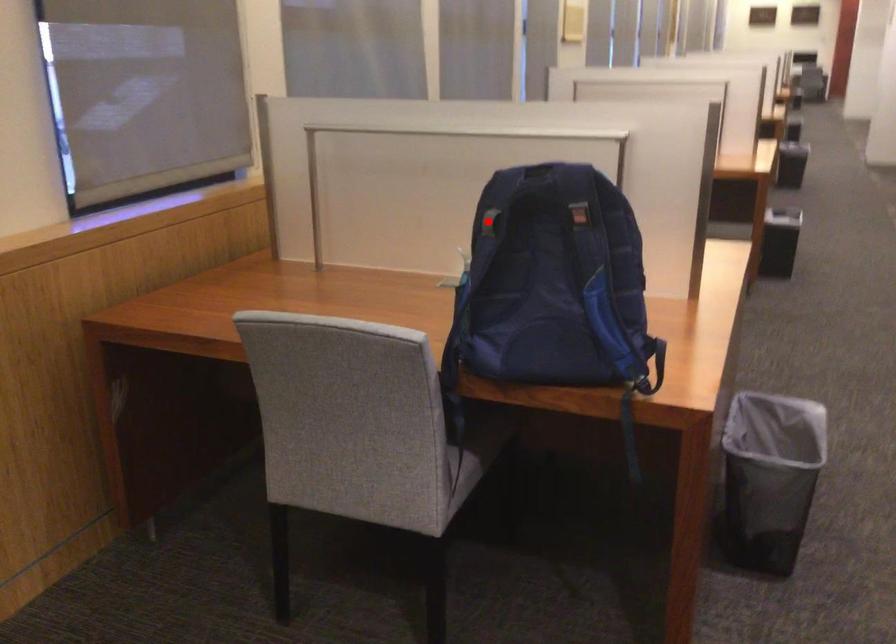
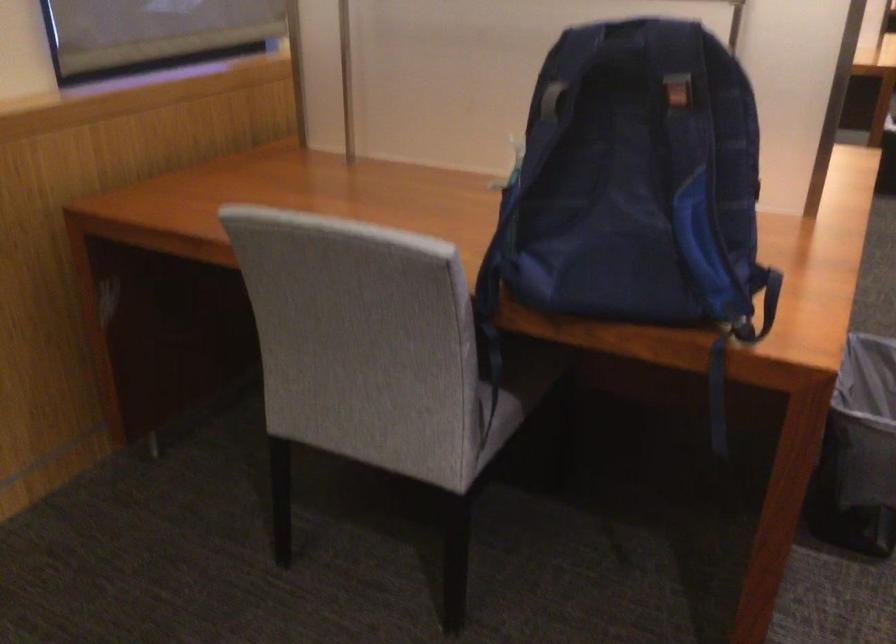
In the second image, find the point that corresponds to the highlighted location in the first image.

(552, 100)